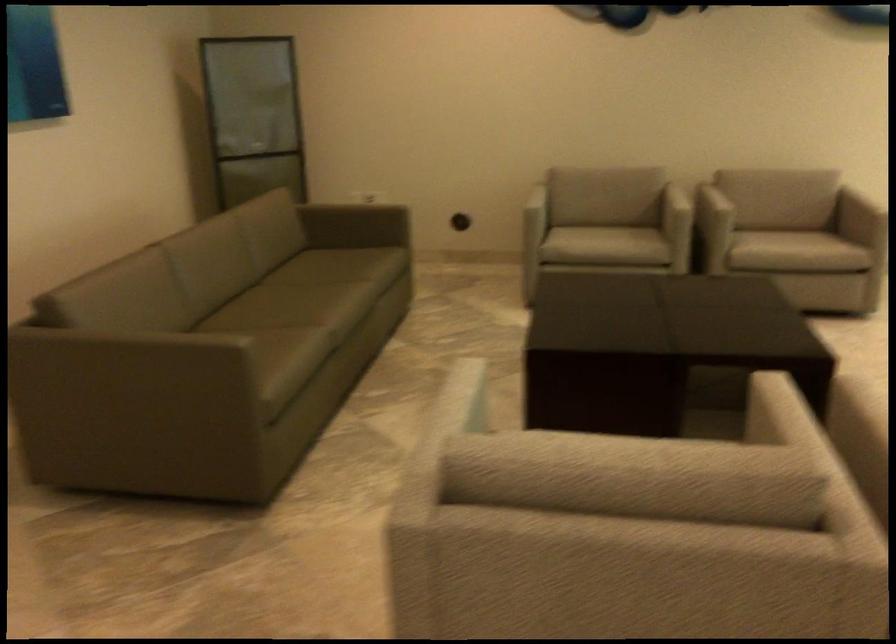
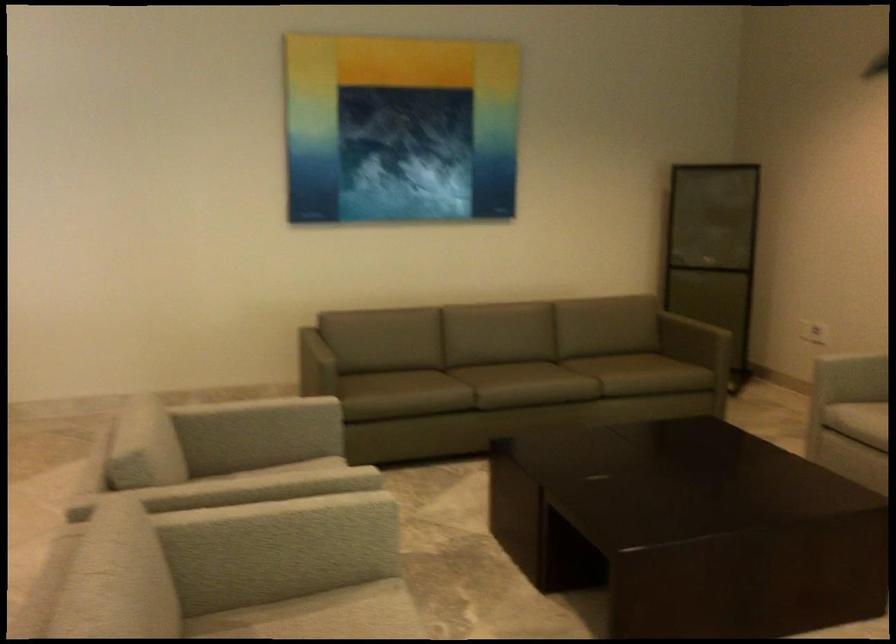
Where in the second image is the point corresponding to pixel 305 199 from the first image?

(713, 317)